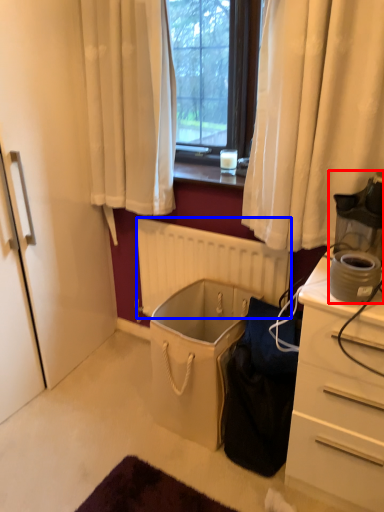
Question: Which of the following is the farthest to the observer, appliance (highlighted by a red box) or radiator (highlighted by a blue box)?

Choices:
 (A) appliance
 (B) radiator

Answer: (B)